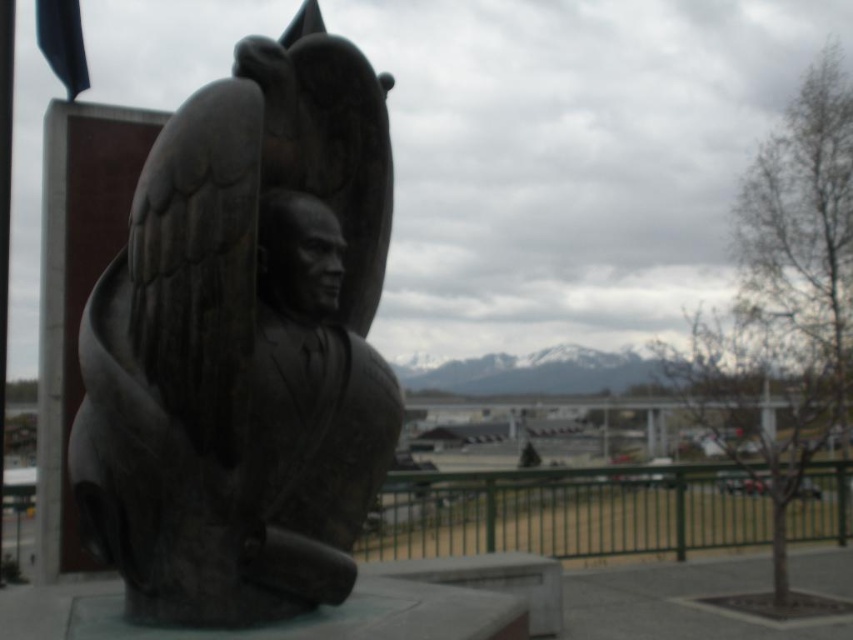
Which is in front, point (239, 500) or point (428, 540)?

Point (239, 500)

Does point (218, 550) come farther from viewer compared to point (416, 513)?

No, it is not.

Where is `bronze statue at center`? The height and width of the screenshot is (640, 853). bronze statue at center is located at coordinates (244, 342).